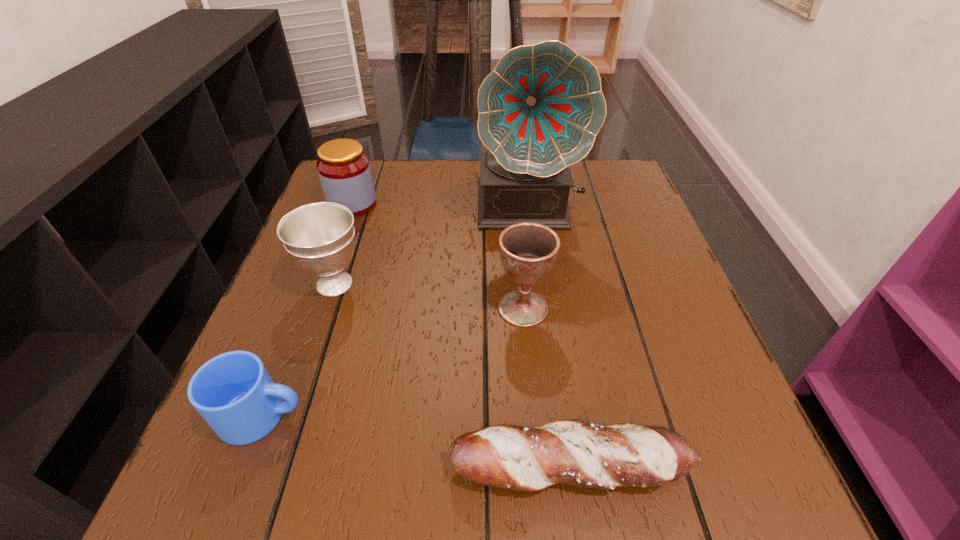
The height and width of the screenshot is (540, 960). Find the location of `free location that satisfies the following two spatial constraints: 1. on the front side of the right chalice; 2. on the right side of the left chalice`. free location that satisfies the following two spatial constraints: 1. on the front side of the right chalice; 2. on the right side of the left chalice is located at coordinates (326, 308).

You are a GUI agent. You are given a task and a screenshot of the screen. Output one action in this format:
    pyautogui.click(x=<x>, y=<y>)
    Task: Click on the free spot that satisfies the following two spatial constraints: 1. on the horn of the record player; 2. on the side of the fifth tallest object with the handle
    This screenshot has height=540, width=960.
    Given the screenshot: What is the action you would take?
    pyautogui.click(x=557, y=415)

I want to click on free point that satisfies the following two spatial constraints: 1. on the horn of the baguet; 2. on the left side of the record player, so click(564, 465).

Where is `free spot that satisfies the following two spatial constraints: 1. on the horn of the baguet; 2. on the right side of the tallest object`? free spot that satisfies the following two spatial constraints: 1. on the horn of the baguet; 2. on the right side of the tallest object is located at coordinates (564, 465).

Locate an element on the screen. vacant space that satisfies the following two spatial constraints: 1. on the side of the second shortest object with the handle; 2. on the right side of the baguet is located at coordinates (244, 465).

The image size is (960, 540). I want to click on free space that satisfies the following two spatial constraints: 1. on the horn of the tallest object; 2. on the side of the mug with the handle, so click(557, 415).

Where is `free space that satisfies the following two spatial constraints: 1. on the front side of the jar; 2. on the left side of the baguet`? The height and width of the screenshot is (540, 960). free space that satisfies the following two spatial constraints: 1. on the front side of the jar; 2. on the left side of the baguet is located at coordinates (258, 465).

The width and height of the screenshot is (960, 540). I want to click on vacant region that satisfies the following two spatial constraints: 1. on the front side of the right chalice; 2. on the side of the second shortest object with the handle, so [x=533, y=415].